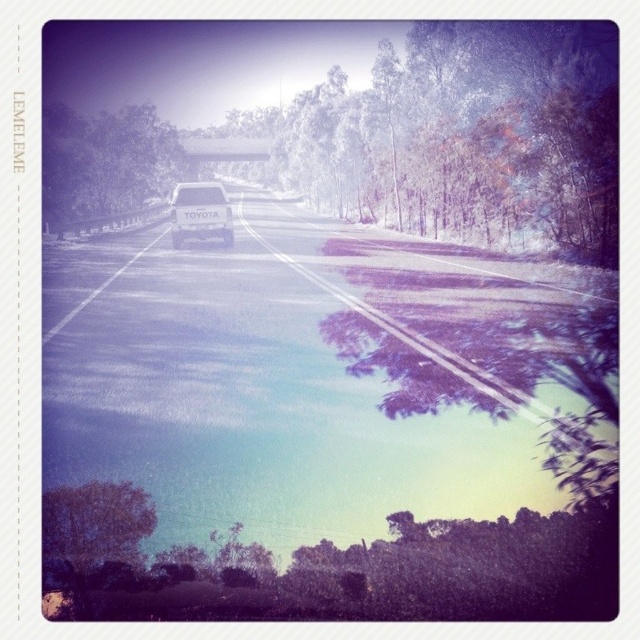
You are a photographer planning to take a picture of the matte white car at center and the green leafy tree at left. Based on their heights, which object should you focus on first if you want to ensure both are in frame without needing to adjust your camera angle?

The green leafy tree at left is taller than the matte white car at center, so you should focus on the green leafy tree at left first to ensure both are in frame without needing to adjust your camera angle.

You are a passenger in the matte white car at center and want to know if the green leafy tree at left is blocking your view of the road ahead. Based on their positions, can you determine if the tree is in front of or behind the car?

The green leafy tree at left is located above the matte white car at center, so it is positioned in front of the car, blocking the view of the road ahead.

You are a drone operator trying to capture aerial footage of the scenic road. Your drone has a maximum range of 200 feet. You see a point marked at coordinates point (156, 138) in the image. Can your drone reach that point?

The point (156, 138) is 196.27 feet from the camera, which is within the drone operator s 200 feet range. Yes, the drone can reach that point.